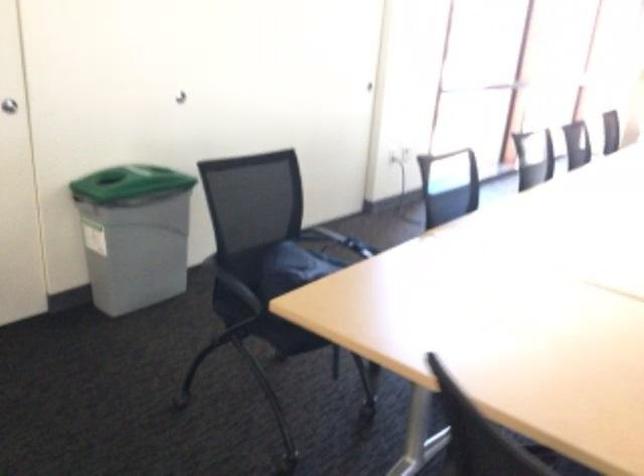
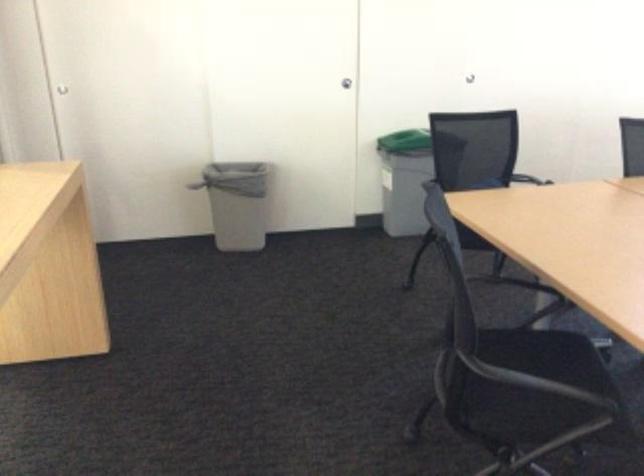
In the second image, find the point that corresponds to pixel 122 185 in the first image.

(404, 141)